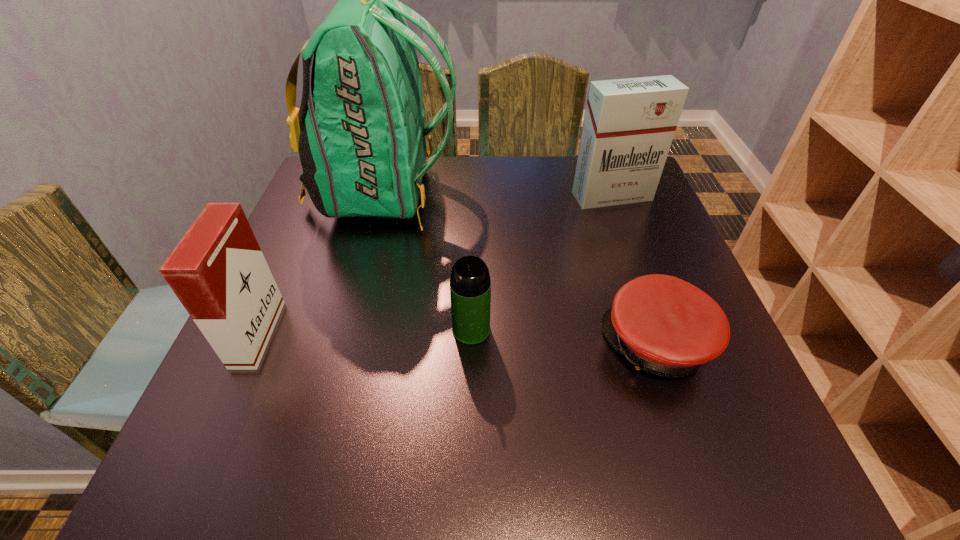
I want to click on backpack, so click(x=360, y=134).

Identify the location of the taller cigarette_case. (629, 124).

Locate an element on the screen. the second tallest object is located at coordinates (629, 124).

Locate an element on the screen. The image size is (960, 540). the shorter cigarette_case is located at coordinates (218, 272).

Locate an element on the screen. the nearer cigarette_case is located at coordinates (218, 272).

Where is `thermos bottle`? thermos bottle is located at coordinates (470, 285).

The height and width of the screenshot is (540, 960). I want to click on the third object from left to right, so click(470, 285).

Where is `cap`? The image size is (960, 540). cap is located at coordinates (664, 325).

At what (x,y) coordinates should I click in order to perform the action: click on blank space located 0.050m on the back of the backpack. Please return your answer as a coordinate pair (x, y). The width and height of the screenshot is (960, 540). Looking at the image, I should click on (477, 193).

Locate an element on the screen. The width and height of the screenshot is (960, 540). vacant position located 0.350m on the left of the farther cigarette_case is located at coordinates (439, 197).